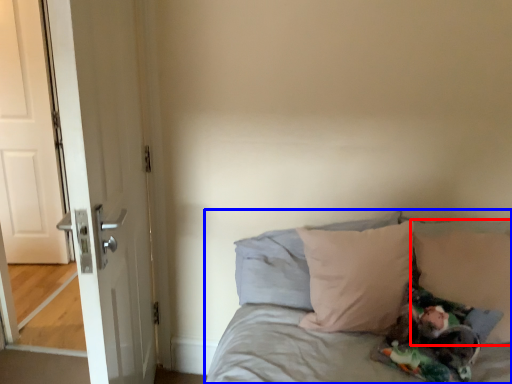
Question: Which point is further to the camera, pillow (highlighted by a red box) or bed (highlighted by a blue box)?

Choices:
 (A) pillow
 (B) bed

Answer: (A)